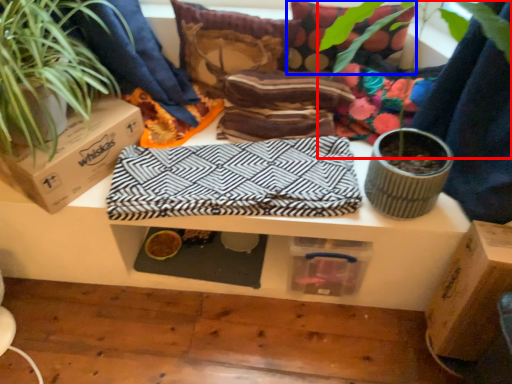
Question: Among these objects, which one is farthest to the camera, vegetation (highlighted by a red box) or pillow (highlighted by a blue box)?

Choices:
 (A) vegetation
 (B) pillow

Answer: (B)